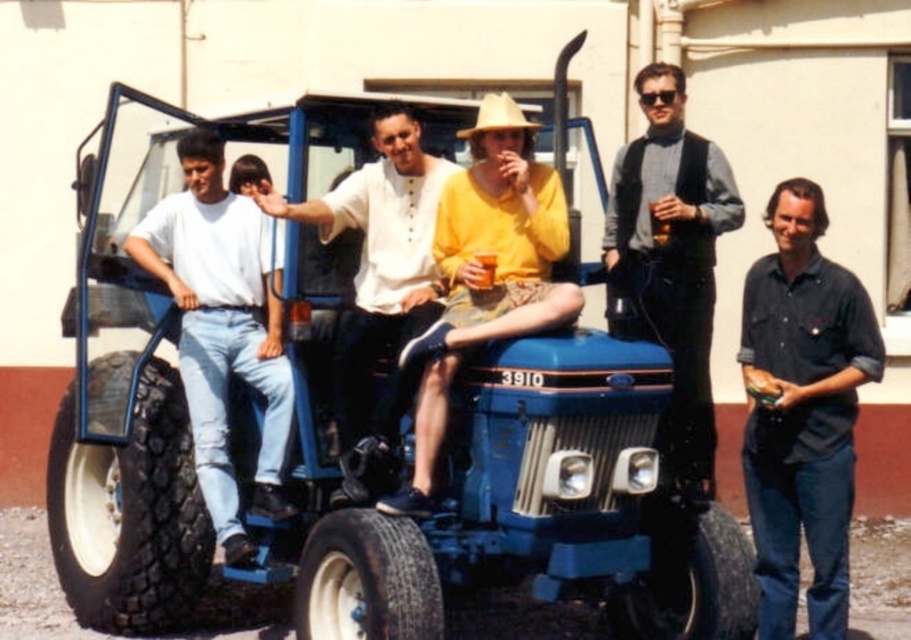
Question: Estimate the real-world distances between objects in this image. Which object is farther from the knit sweater vest at center?

Choices:
 (A) dark blue shirt at right
 (B) white cotton shirt at left
 (C) tan straw cowboy hat at center

Answer: (B)

Question: Does white cotton shirt at left have a smaller size compared to yellow matte shirt at center?

Choices:
 (A) yes
 (B) no

Answer: (B)

Question: Based on their relative distances, which object is nearer to the dark blue shirt at right?

Choices:
 (A) blue rubber tractor at center
 (B) yellow matte shirt at center
 (C) tan straw cowboy hat at center
 (D) white cotton shirt at left

Answer: (B)

Question: Does white cotton shirt at center appear over tan straw cowboy hat at center?

Choices:
 (A) no
 (B) yes

Answer: (A)

Question: Is the position of dark blue shirt at right more distant than that of tan straw cowboy hat at center?

Choices:
 (A) yes
 (B) no

Answer: (B)

Question: Which object appears closest to the camera in this image?

Choices:
 (A) white cotton shirt at center
 (B) knit sweater vest at center
 (C) white cotton shirt at left

Answer: (A)